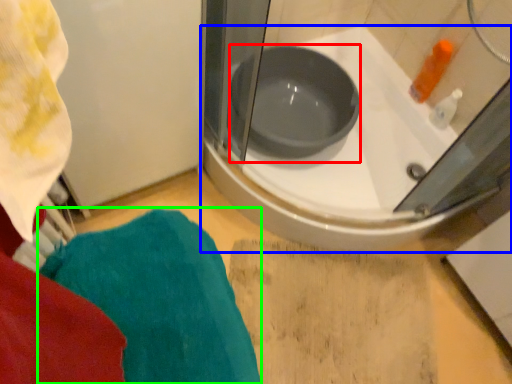
Question: Which is nearer to the basin (highlighted by a red box)? bathtub (highlighted by a blue box) or bath towel (highlighted by a green box).

Choices:
 (A) bathtub
 (B) bath towel

Answer: (A)